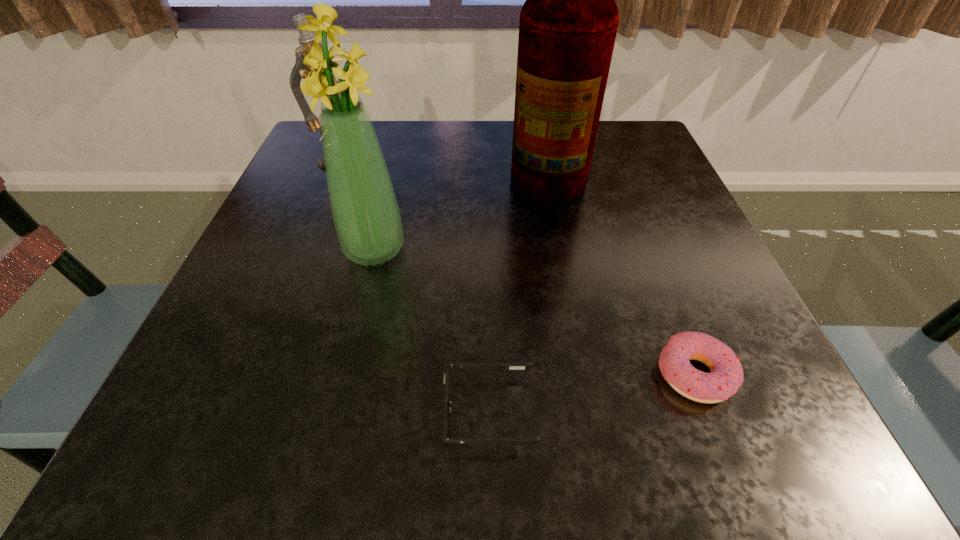
The height and width of the screenshot is (540, 960). What are the coordinates of `object that is at the left edge` in the screenshot? It's located at (306, 39).

The image size is (960, 540). What are the coordinates of `object that is at the right edge` in the screenshot? It's located at pos(726,376).

Locate an element on the screen. object that is at the far left corner is located at coordinates (306, 39).

Locate an element on the screen. The height and width of the screenshot is (540, 960). object positioned at the near right corner is located at coordinates (726, 376).

Find the location of a particular element. This screenshot has height=540, width=960. blank space at the far edge of the desktop is located at coordinates (426, 141).

Locate an element on the screen. vacant space at the near edge of the desktop is located at coordinates (381, 449).

In the image, there is a desktop. Where is `vacant space at the left edge`? The height and width of the screenshot is (540, 960). vacant space at the left edge is located at coordinates (254, 307).

At what (x,y) coordinates should I click in order to perform the action: click on vacant space at the right edge. Please return your answer as a coordinate pair (x, y). This screenshot has width=960, height=540. Looking at the image, I should click on (647, 191).

Identify the location of vacant space at the far right corner of the desktop. (607, 124).

This screenshot has height=540, width=960. In order to click on empty space between the third shortest object and the fire extinguisher in this screenshot , I will do `click(446, 163)`.